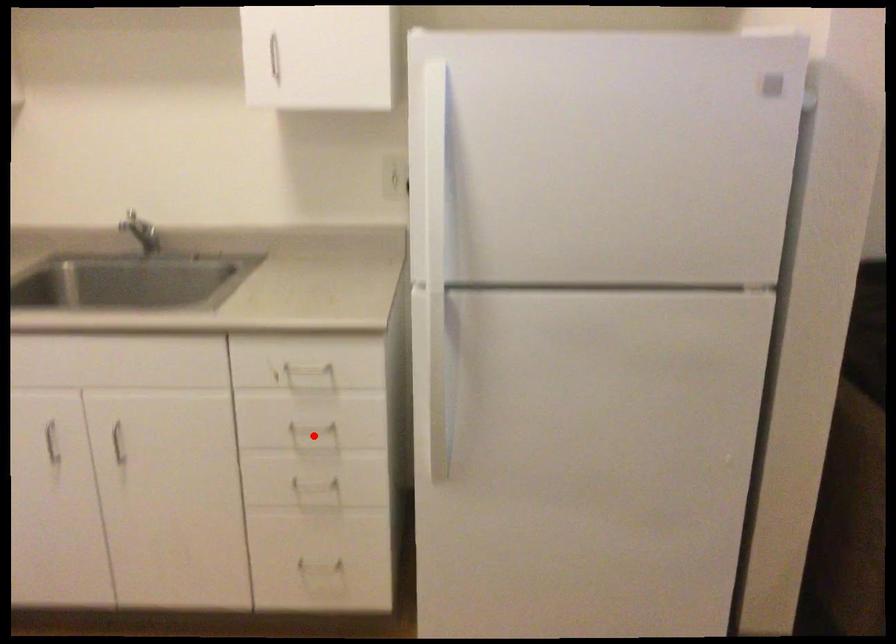
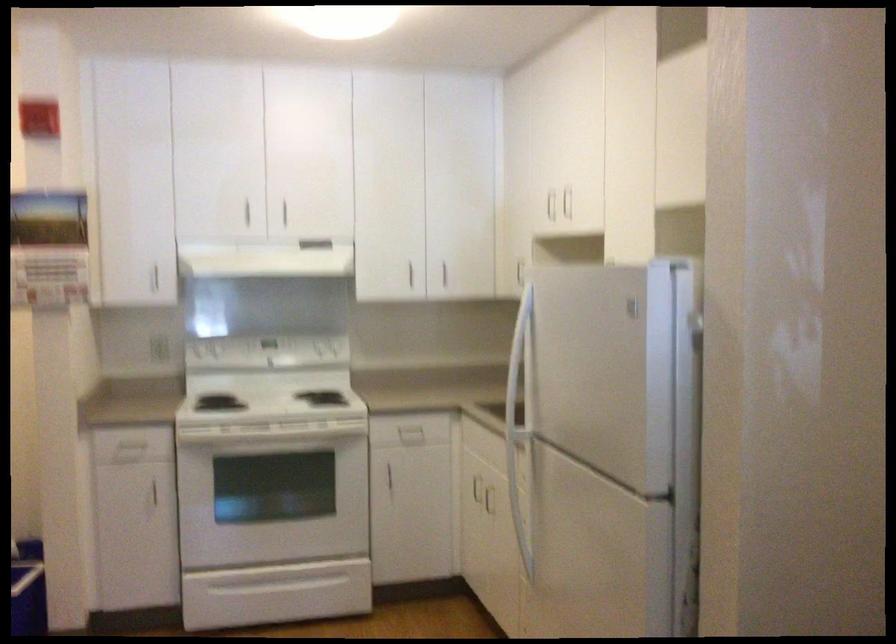
Question: I am providing you with two images of the same scene from different viewpoints. A red point is marked on the first image. Is the red point's position out of view in image 2?

Choices:
 (A) Yes
 (B) No

Answer: (A)